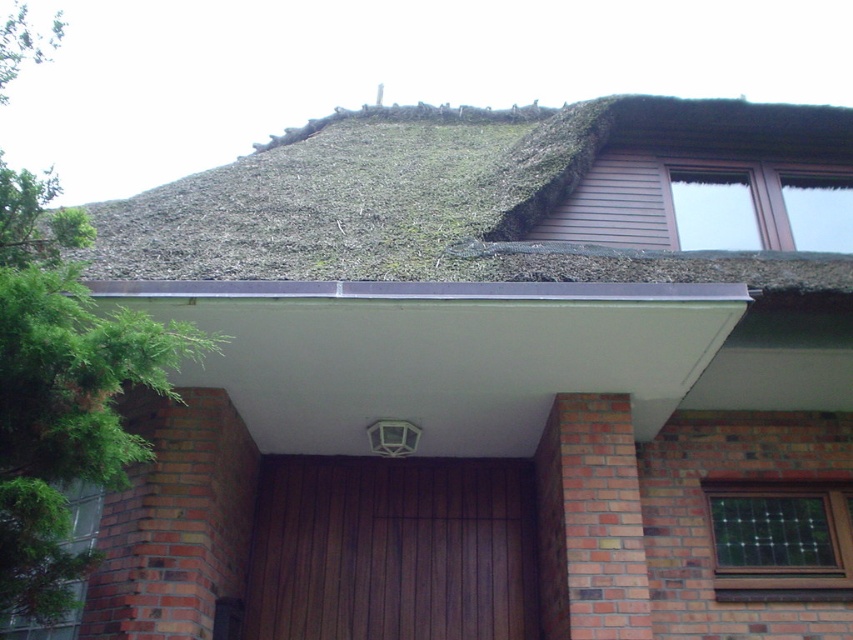
Question: Among these objects, which one is nearest to the camera?

Choices:
 (A) brown wooden door at center
 (B) green thatch roof at upper center

Answer: (B)

Question: Can you confirm if green thatch roof at upper center is positioned to the right of brown wooden door at center?

Choices:
 (A) no
 (B) yes

Answer: (B)

Question: Can you confirm if green thatch roof at upper center is wider than brown wooden door at center?

Choices:
 (A) yes
 (B) no

Answer: (A)

Question: Among these objects, which one is nearest to the camera?

Choices:
 (A) green thatch roof at upper center
 (B) brown wooden door at center

Answer: (A)

Question: Can you confirm if green thatch roof at upper center is positioned to the left of brown wooden door at center?

Choices:
 (A) yes
 (B) no

Answer: (B)